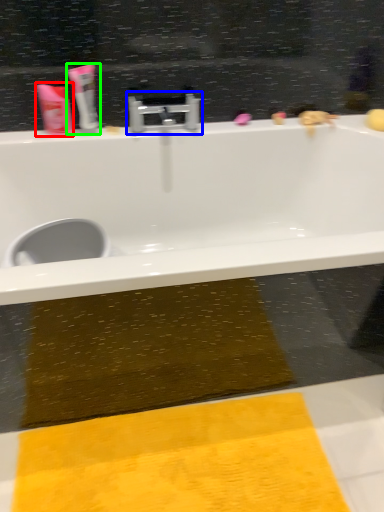
Question: Estimate the real-world distances between objects in this image. Which object is closer to toiletry (highlighted by a red box), tap (highlighted by a blue box) or toothpaste (highlighted by a green box)?

Choices:
 (A) tap
 (B) toothpaste

Answer: (B)